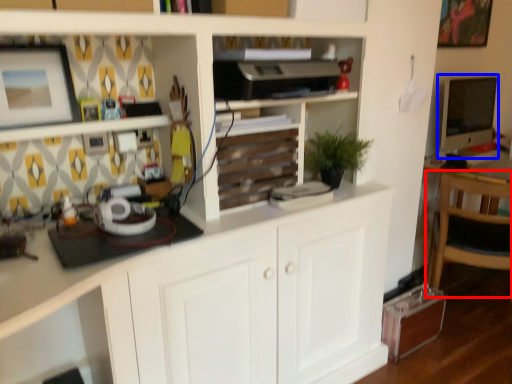
Question: Which of the following is the farthest to the observer, chair (highlighted by a red box) or computer monitor (highlighted by a blue box)?

Choices:
 (A) chair
 (B) computer monitor

Answer: (B)